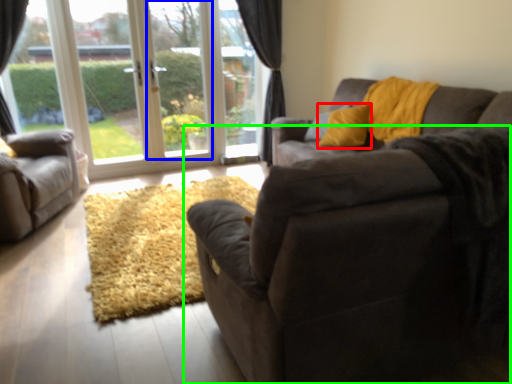
Question: Based on their relative distances, which object is farther from throw pillow (highlighted by a red box)? Choose from window screen (highlighted by a blue box) and studio couch (highlighted by a green box).

Choices:
 (A) window screen
 (B) studio couch

Answer: (B)